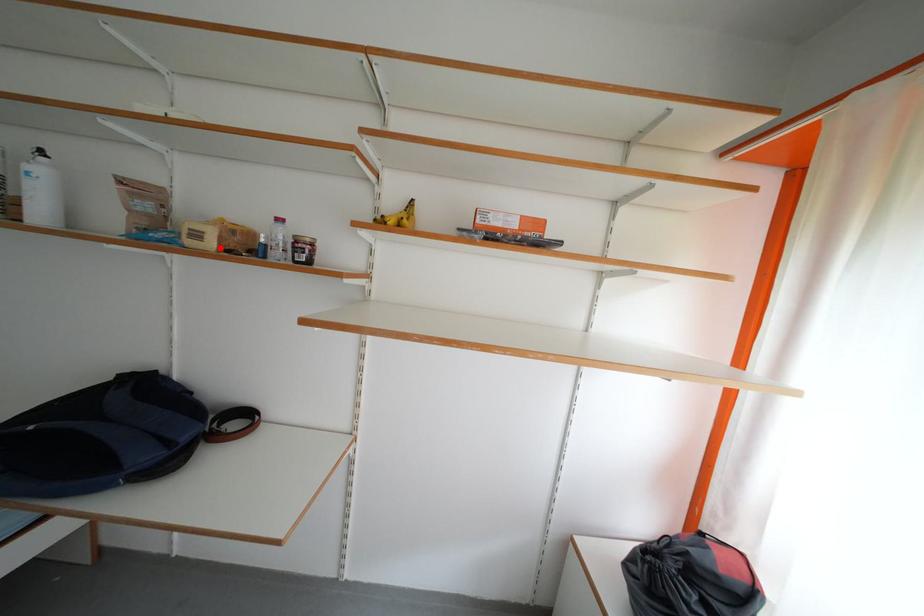
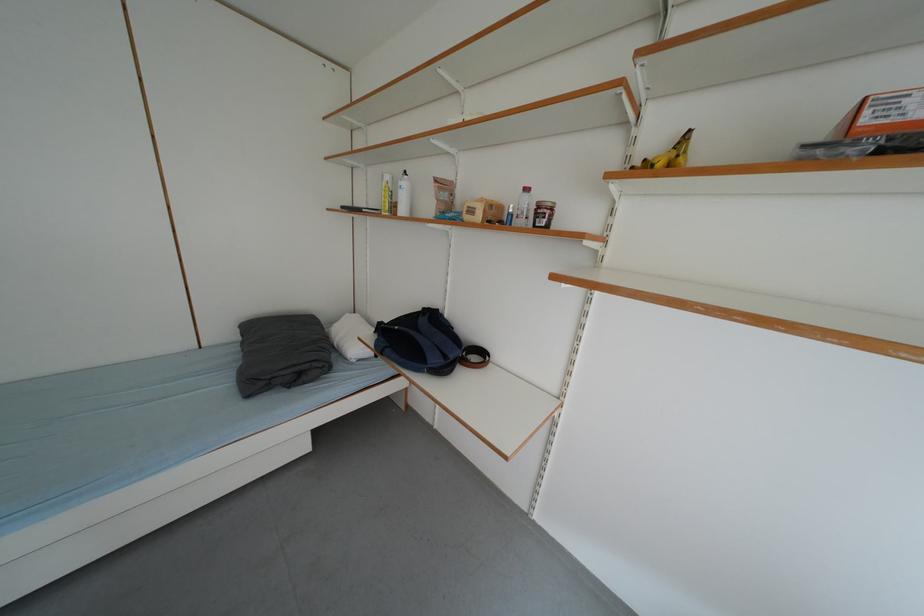
The point at the highlighted location is marked in the first image. Where is the corresponding point in the second image?

(487, 220)